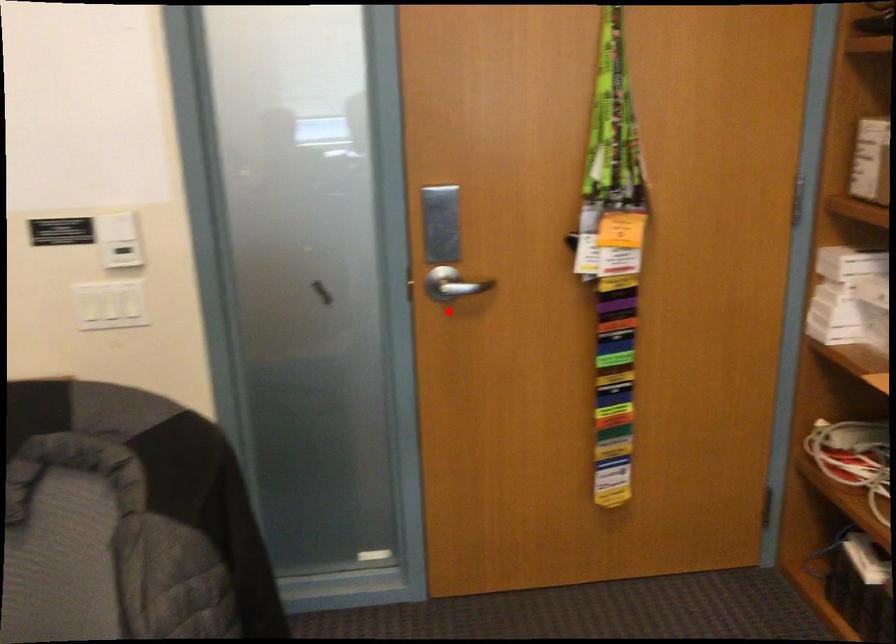
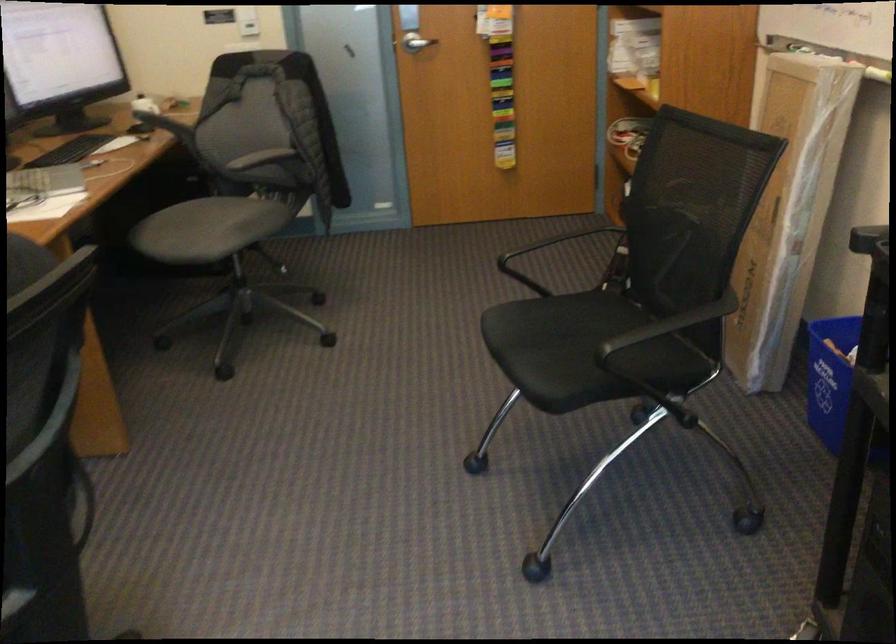
Question: I am providing you with two images of the same scene from different viewpoints. A red point is marked on the first image. Is the red point's position out of view in image 2?

Choices:
 (A) Yes
 (B) No

Answer: (B)